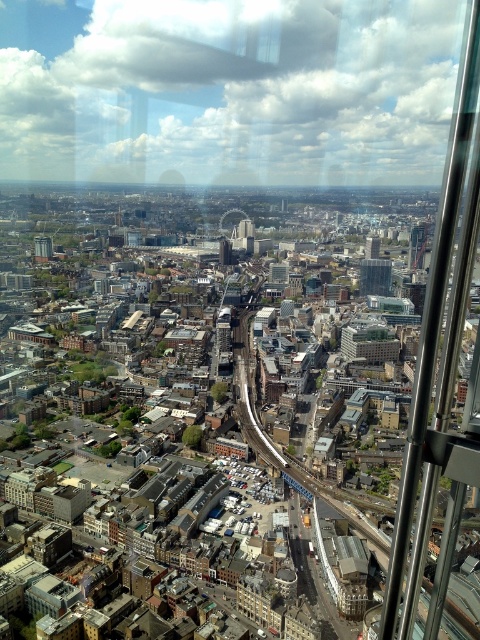
Which is more to the left, glassy reflective skyscraper at center or matte gray tower at center?

matte gray tower at center is more to the left.

Can you confirm if glassy reflective skyscraper at center is positioned above matte gray tower at center?

No.

Looking at this image, who is more forward, (361,264) or (44,257)?

Point (361,264) is more forward.

At what (x,y) coordinates should I click in order to perform the action: click on glassy reflective skyscraper at center. Please return your answer as a coordinate pair (x, y). The width and height of the screenshot is (480, 640). Looking at the image, I should click on (374, 276).

Which of these two, glassy reflective skyscraper at center or matte glass tower at center, stands shorter?

matte glass tower at center

Based on the photo, who is higher up, glassy reflective skyscraper at center or matte glass tower at center?

Positioned higher is matte glass tower at center.

Is point (371, 292) positioned in front of point (372, 250)?

Yes, point (371, 292) is in front of point (372, 250).

Find the location of a particular element. glassy reflective skyscraper at center is located at coordinates pos(374,276).

Which is above, matte gray tower at center or matte glass tower at center?

Positioned higher is matte glass tower at center.

Which is more to the left, matte gray tower at center or matte glass tower at center?

matte gray tower at center

Does point (39, 244) come in front of point (374, 252)?

That is True.

At what (x,y) coordinates should I click in order to perform the action: click on matte gray tower at center. Please return your answer as a coordinate pair (x, y). This screenshot has height=640, width=480. Looking at the image, I should click on (43, 248).